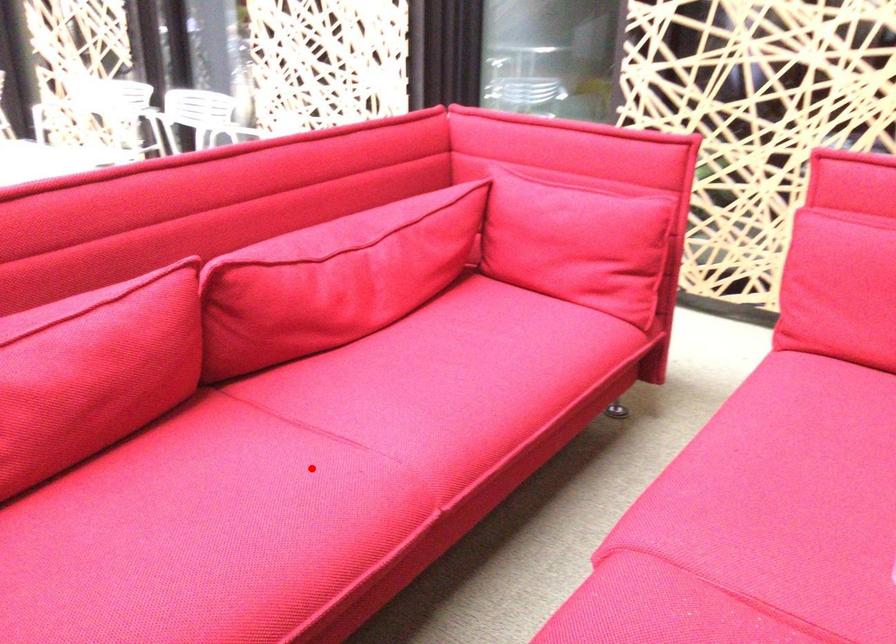
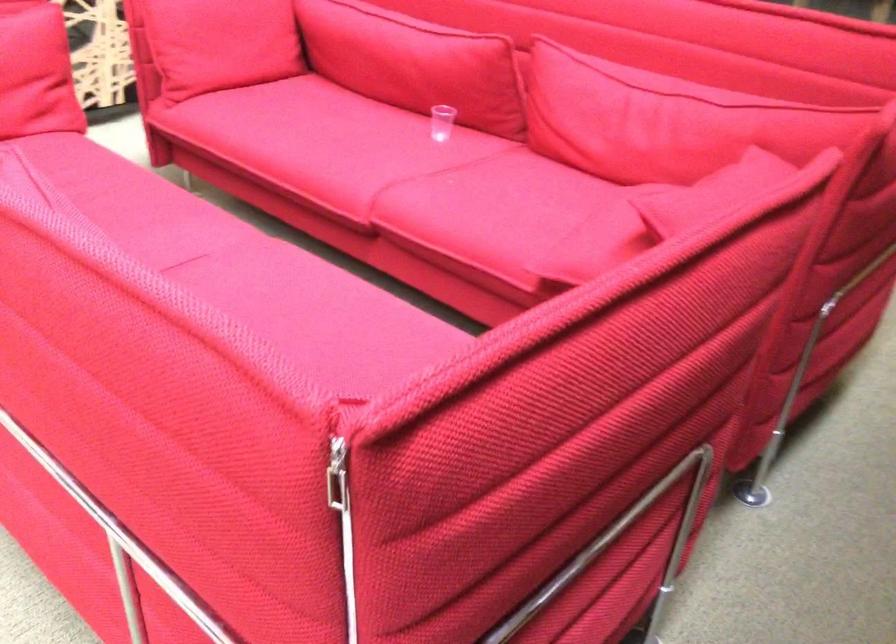
Question: A red point is marked in image1. In image2, is the corresponding 3D point closer to the camera or farther? Reply with the corresponding letter.

Choices:
 (A) The corresponding 3D point is closer.
 (B) The corresponding 3D point is farther.

Answer: (B)